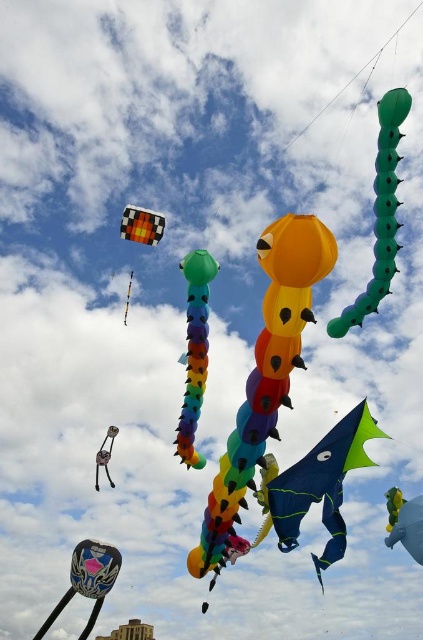
Question: Among these points, which one is farthest from the camera?

Choices:
 (A) tap(376, 180)
 (B) tap(126, 308)

Answer: (B)

Question: Where is blue matte kite at center located in relation to green rubber caterpillar at upper right in the image?

Choices:
 (A) right
 (B) left

Answer: (B)

Question: Which of the following is the closest to the observer?

Choices:
 (A) (183, 406)
 (B) (142, 228)

Answer: (A)

Question: Does green rubber caterpillar at upper right appear under shiny metallic dragon at center?

Choices:
 (A) no
 (B) yes

Answer: (A)

Question: Can you confirm if rainbow fabric tentacle at center is positioned to the left of shiny metallic dragon at center?

Choices:
 (A) no
 (B) yes

Answer: (B)

Question: Among these points, which one is farthest from the camera?

Choices:
 (A) (397, 118)
 (B) (274, 506)
 (C) (145, 228)
 (D) (104, 438)

Answer: (C)